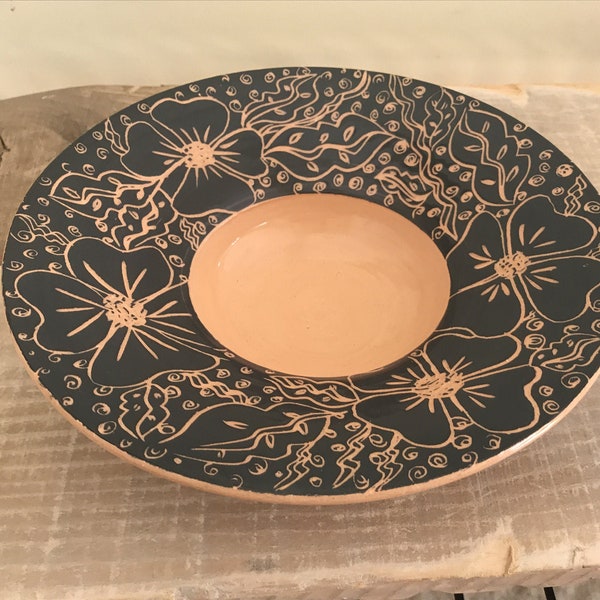
Where is `gold rim of plate`? gold rim of plate is located at coordinates [473, 471].